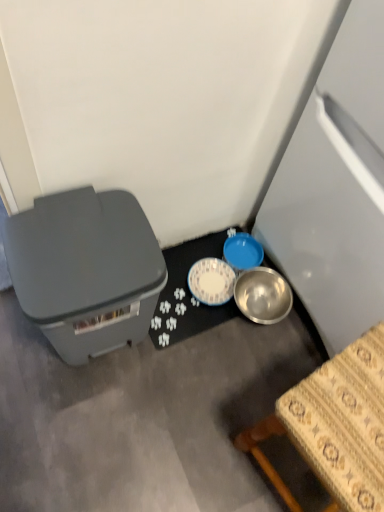
The height and width of the screenshot is (512, 384). In order to click on empty space that is ontop of matte gray storage box at left (from a real-world perspective) in this screenshot , I will do `click(90, 247)`.